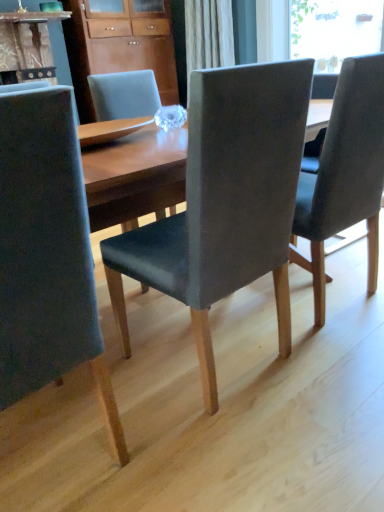
You are a GUI agent. You are given a task and a screenshot of the screen. Output one action in this format:
    pyautogui.click(x=<x>, y=<y>)
    Task: Click on the vacant area that is in front of matte gray chair at center, positioned as the second chair in right-to-left order
    This screenshot has height=512, width=384.
    Given the screenshot: What is the action you would take?
    [240, 448]